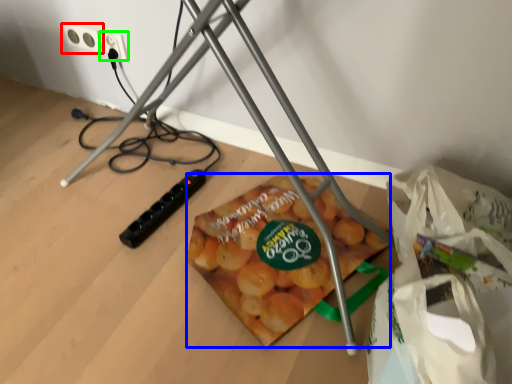
Question: Considering the real-world distances, which object is closest to power plugs and sockets (highlighted by a red box)? snack (highlighted by a blue box) or power plugs and sockets (highlighted by a green box).

Choices:
 (A) snack
 (B) power plugs and sockets

Answer: (B)